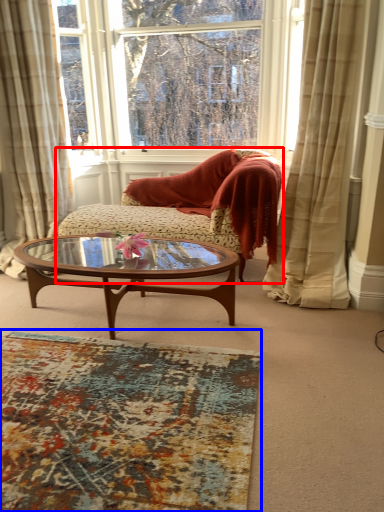
Question: Among these objects, which one is farthest to the camera, studio couch (highlighted by a red box) or plain (highlighted by a blue box)?

Choices:
 (A) studio couch
 (B) plain

Answer: (A)